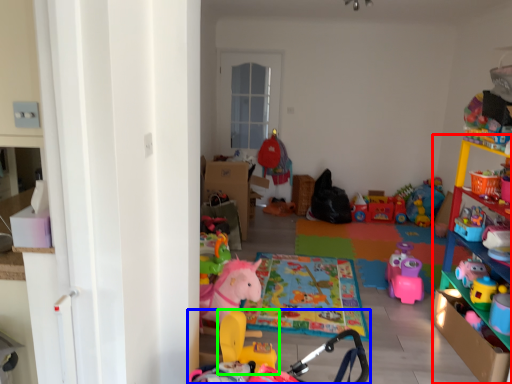
Question: Based on their relative distances, which object is nearer to shelf (highlighted by a red box)? Choose from toy (highlighted by a blue box) and toy (highlighted by a green box).

Choices:
 (A) toy
 (B) toy

Answer: (A)